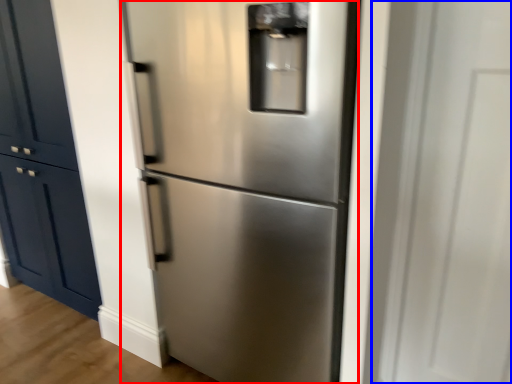
Question: Which of the following is the farthest to the observer, refrigerator (highlighted by a red box) or glass door (highlighted by a blue box)?

Choices:
 (A) refrigerator
 (B) glass door

Answer: (A)